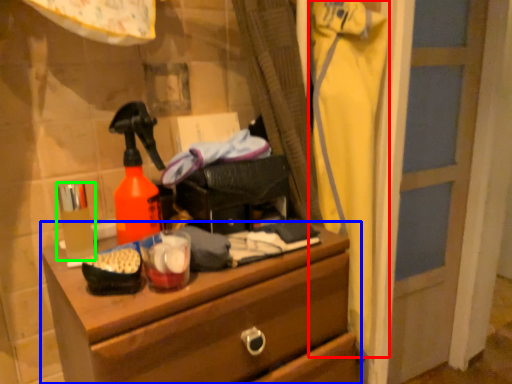
Question: Which is farther away from clothing (highlighted by a red box)? chest of drawers (highlighted by a blue box) or toiletry (highlighted by a green box)?

Choices:
 (A) chest of drawers
 (B) toiletry

Answer: (B)